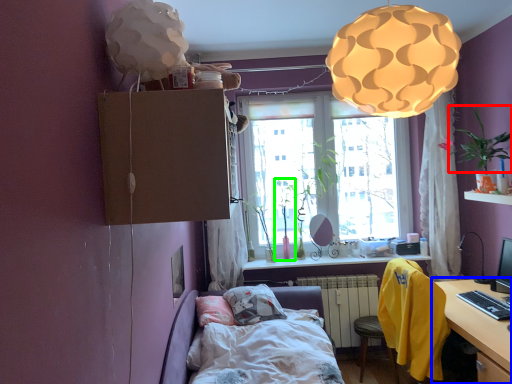
Question: Estimate the real-world distances between objects in this image. Which object is closer to plant (highlighted by a red box), table (highlighted by a blue box) or plant (highlighted by a green box)?

Choices:
 (A) table
 (B) plant

Answer: (A)